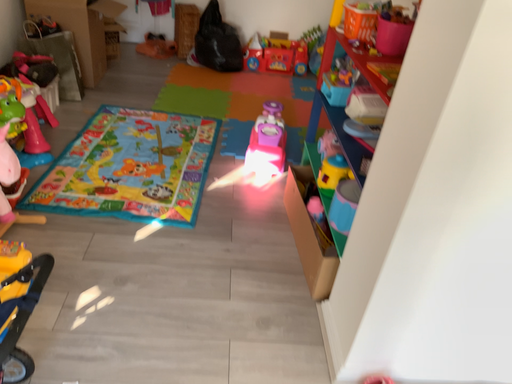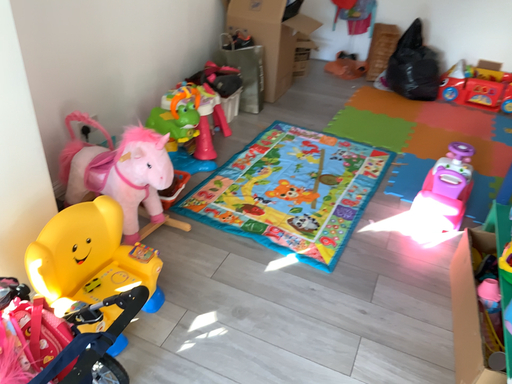
Question: Which way did the camera rotate in the video?

Choices:
 (A) rotated right
 (B) rotated left

Answer: (B)